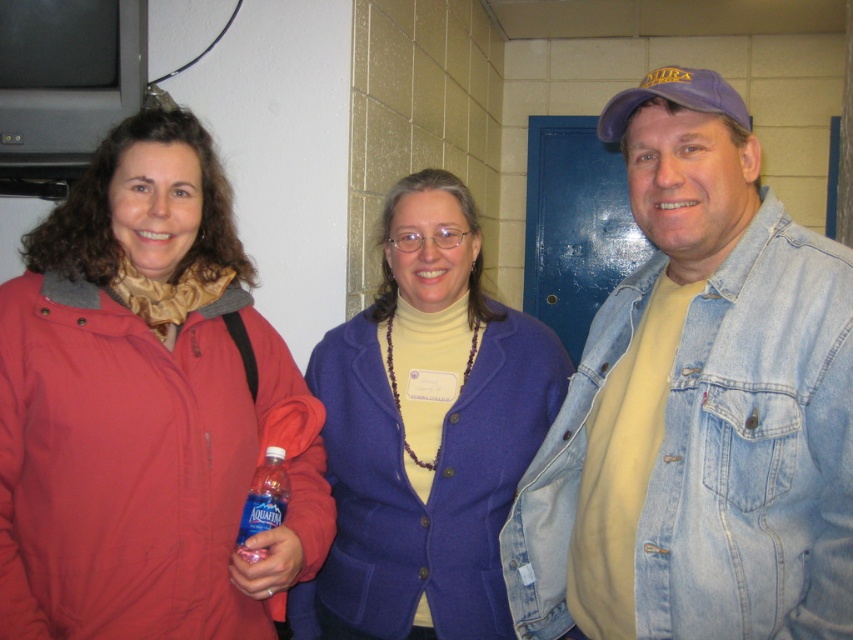
Question: Estimate the real-world distances between objects in this image. Which object is farther from the clear plastic bottle at center?

Choices:
 (A) matte red jacket at left
 (B) denim jacket at right
 (C) matte purple blazer at center

Answer: (B)

Question: Can you confirm if matte red jacket at left is positioned above clear plastic bottle at center?

Choices:
 (A) no
 (B) yes

Answer: (B)

Question: Can you confirm if denim jacket at right is positioned to the left of clear plastic bottle at center?

Choices:
 (A) yes
 (B) no

Answer: (B)

Question: Does matte purple blazer at center appear under purple fabric baseball cap at right?

Choices:
 (A) yes
 (B) no

Answer: (A)

Question: Among these objects, which one is farthest from the camera?

Choices:
 (A) denim jacket at right
 (B) clear plastic bottle at center

Answer: (B)

Question: Which of the following is the farthest from the observer?

Choices:
 (A) clear plastic bottle at center
 (B) matte purple blazer at center
 (C) matte red jacket at left

Answer: (B)